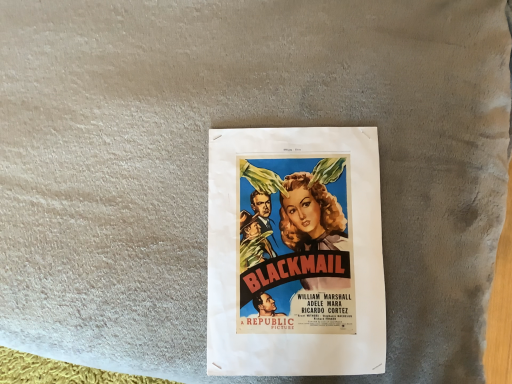
Question: Should I look upward or downward to see matte paper poster at center?

Choices:
 (A) down
 (B) up

Answer: (A)